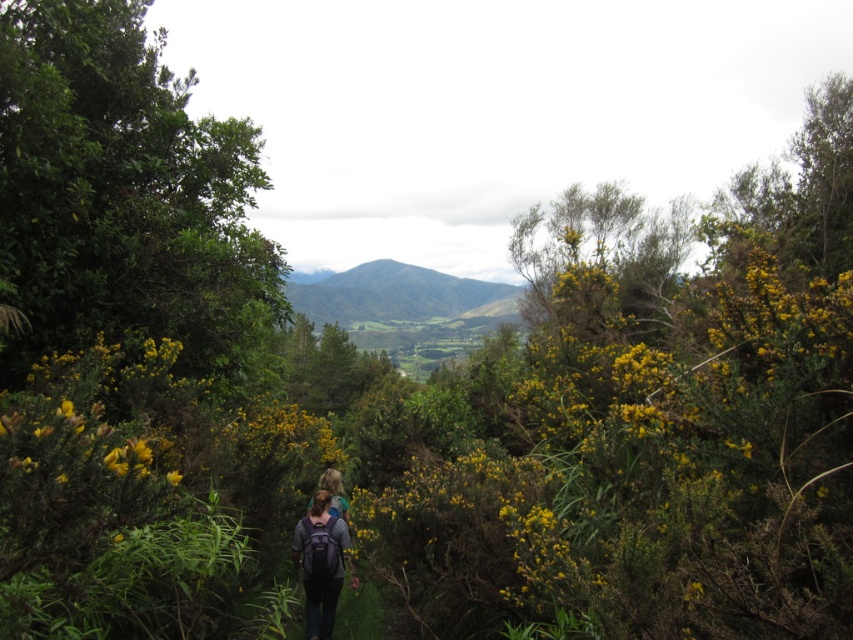
Based on the photo, is matte purple backpack at center below yellow matte flower at center?

Yes.

Does matte purple backpack at center appear on the left side of yellow matte flower at center?

No, matte purple backpack at center is not to the left of yellow matte flower at center.

What do you see at coordinates (321, 563) in the screenshot? The width and height of the screenshot is (853, 640). I see `matte purple backpack at center` at bounding box center [321, 563].

I want to click on matte purple backpack at center, so click(321, 563).

Which is below, green leafy bush at upper left or matte purple backpack at center?

matte purple backpack at center is lower down.

Locate an element on the screen. This screenshot has height=640, width=853. green leafy bush at upper left is located at coordinates (122, 195).

Is point (416, 298) farther from viewer compared to point (317, 612)?

Yes.

Which is in front, point (381, 285) or point (322, 589)?

Positioned in front is point (322, 589).

At what (x,y) coordinates should I click in order to perform the action: click on green grassy hillside at center. Please return your answer as a coordinate pair (x, y). The image size is (853, 640). Looking at the image, I should click on (397, 296).